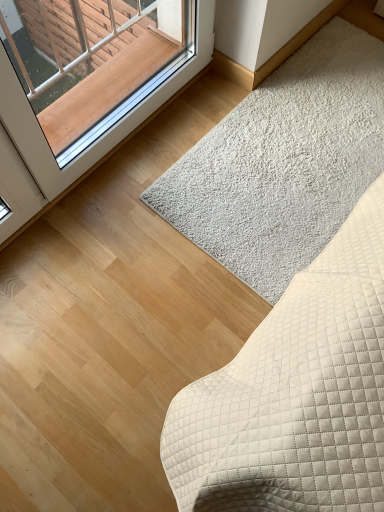
Where is `free space above white shaggy rug at center (from a real-world perspective)`? This screenshot has height=512, width=384. free space above white shaggy rug at center (from a real-world perspective) is located at coordinates (306, 136).